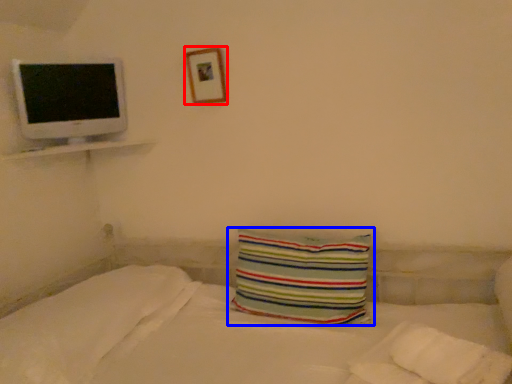
Question: Which object appears closest to the camera in this image, picture frame (highlighted by a red box) or pillow (highlighted by a blue box)?

Choices:
 (A) picture frame
 (B) pillow

Answer: (B)